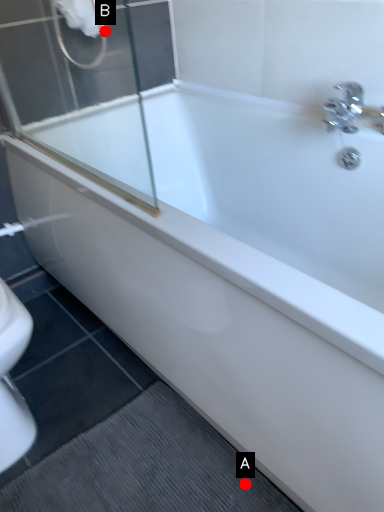
Question: Two points are circled on the image, labeled by A and B beside each circle. Which of the following is the farthest from the observer?

Choices:
 (A) A is further
 (B) B is further

Answer: (B)